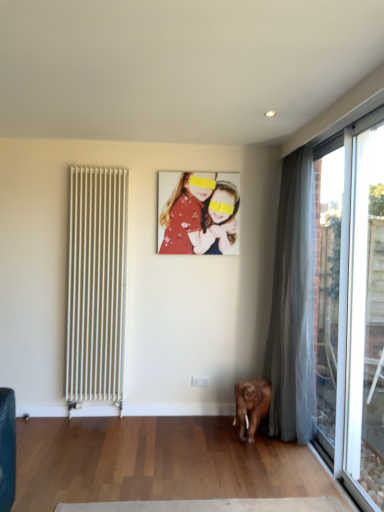
The width and height of the screenshot is (384, 512). I want to click on free point below matte floral dress at center (from a real-world perspective), so click(x=193, y=411).